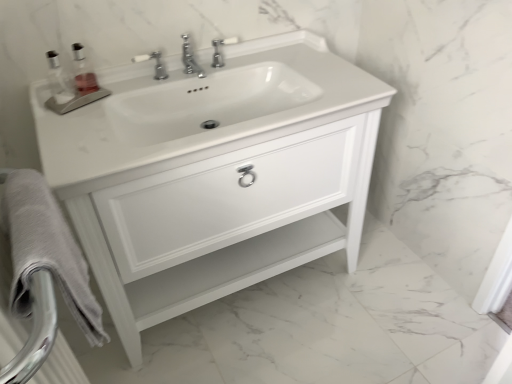
The width and height of the screenshot is (512, 384). Find the location of `free spot to the left of chrome metallic faucet at center`. free spot to the left of chrome metallic faucet at center is located at coordinates (139, 86).